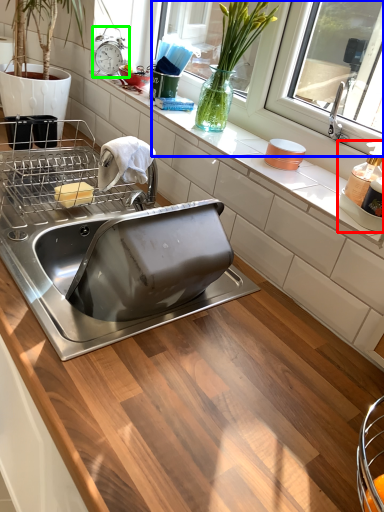
Question: Based on their relative distances, which object is nearer to appliance (highlighted by a red box)? Choose from window screen (highlighted by a blue box) and alarm clock (highlighted by a green box).

Choices:
 (A) window screen
 (B) alarm clock

Answer: (A)